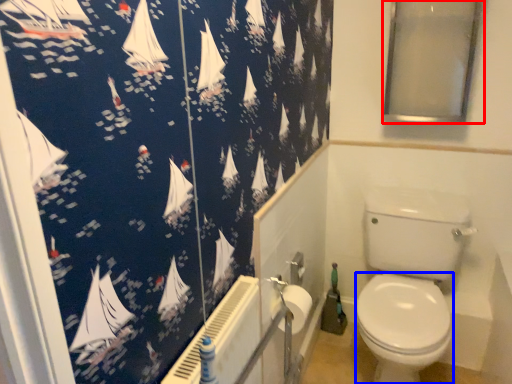
Question: Which point is closer to the camera, window screen (highlighted by a red box) or bidet (highlighted by a blue box)?

Choices:
 (A) window screen
 (B) bidet

Answer: (A)